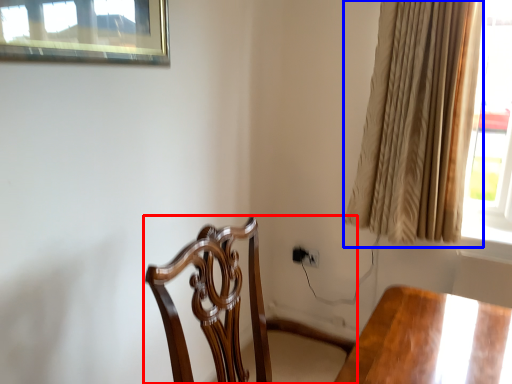
Question: Which object is further to the camera taking this photo, chair (highlighted by a red box) or curtain (highlighted by a blue box)?

Choices:
 (A) chair
 (B) curtain

Answer: (B)